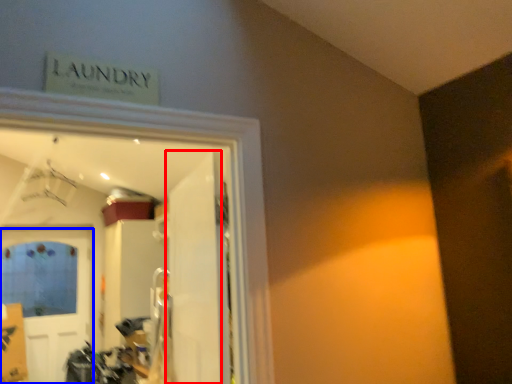
Question: Among these objects, which one is nearest to the camera, door (highlighted by a red box) or door (highlighted by a blue box)?

Choices:
 (A) door
 (B) door

Answer: (A)